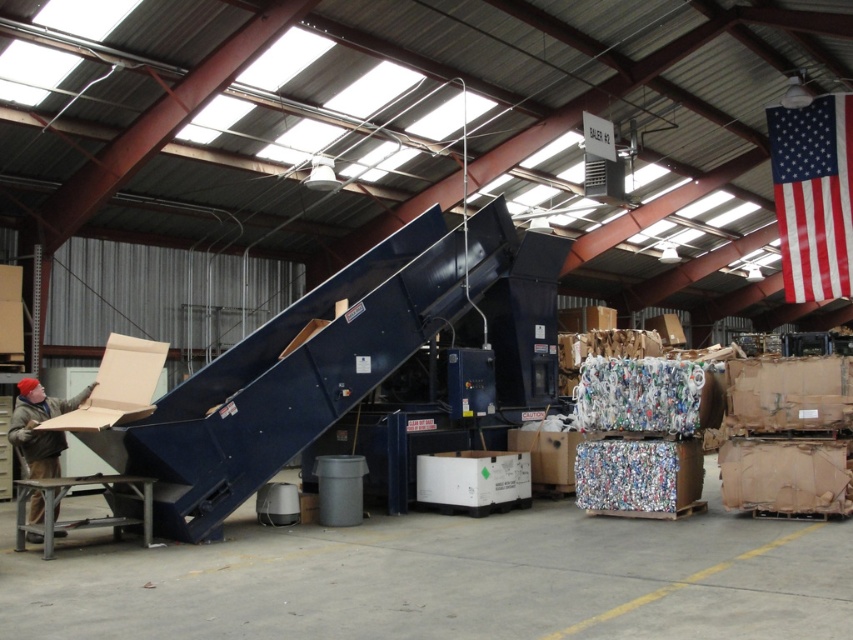
Question: Is red-white-and-blue fabric flag at upper right thinner than matte cardboard box at lower left?

Choices:
 (A) yes
 (B) no

Answer: (B)

Question: Can you confirm if red-white-and-blue fabric flag at upper right is positioned above matte cardboard box at lower left?

Choices:
 (A) yes
 (B) no

Answer: (A)

Question: Which point is farther to the camera?

Choices:
 (A) matte cardboard box at lower left
 (B) red-white-and-blue fabric flag at upper right

Answer: (B)

Question: Which point is farther to the camera?

Choices:
 (A) red-white-and-blue fabric flag at upper right
 (B) matte cardboard box at lower left

Answer: (A)

Question: Can you confirm if red-white-and-blue fabric flag at upper right is smaller than matte cardboard box at lower left?

Choices:
 (A) yes
 (B) no

Answer: (B)